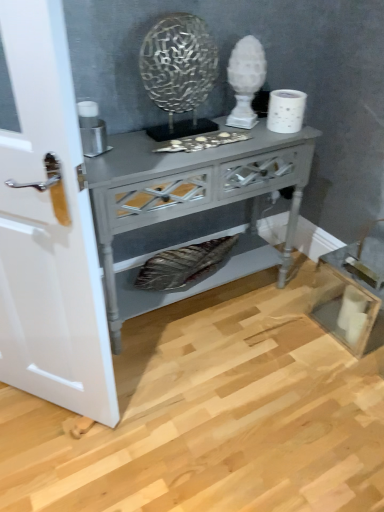
Locate an element on the screen. The image size is (384, 512). vacant area situated below white glossy door at left (from a real-world perspective) is located at coordinates click(x=45, y=410).